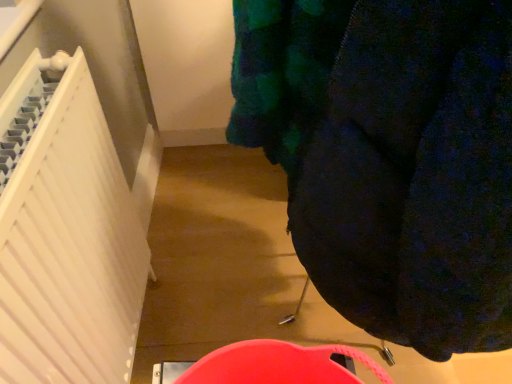
Question: Based on their sizes in the image, would you say dark blue fabric at center is bigger or smaller than white matte radiator at left?

Choices:
 (A) big
 (B) small

Answer: (A)

Question: From a real-world perspective, is dark blue fabric at center above or below white matte radiator at left?

Choices:
 (A) below
 (B) above

Answer: (B)

Question: In the image, is dark blue fabric at center positioned in front of or behind white matte radiator at left?

Choices:
 (A) behind
 (B) front

Answer: (B)

Question: In terms of width, does white matte radiator at left look wider or thinner when compared to dark blue fabric at center?

Choices:
 (A) wide
 (B) thin

Answer: (B)

Question: Based on their positions, is white matte radiator at left located to the left or right of dark blue fabric at center?

Choices:
 (A) right
 (B) left

Answer: (B)

Question: In the image, is white matte radiator at left positioned in front of or behind dark blue fabric at center?

Choices:
 (A) front
 (B) behind

Answer: (B)

Question: Is white matte radiator at left spatially inside dark blue fabric at center, or outside of it?

Choices:
 (A) outside
 (B) inside

Answer: (A)